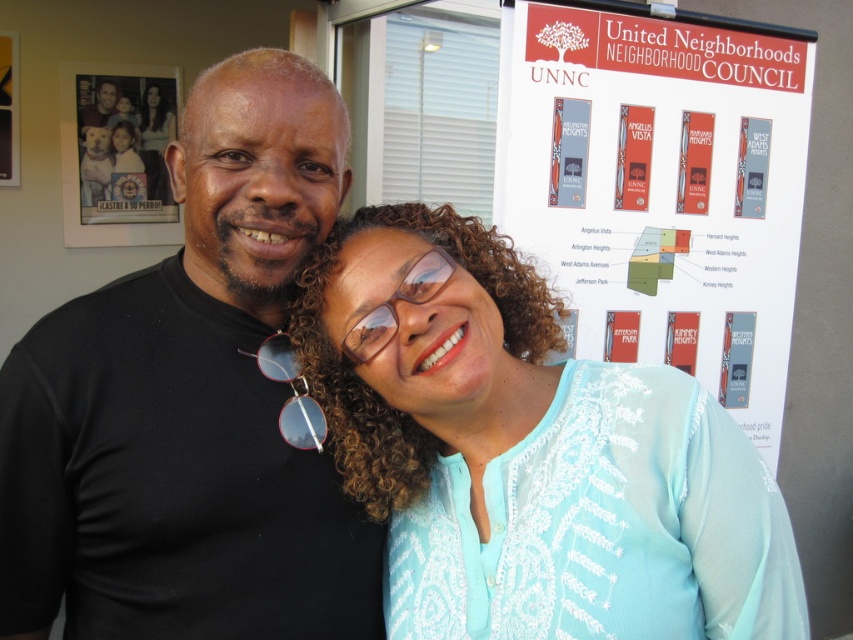
Question: Which object is closer to the camera taking this photo?

Choices:
 (A) black matte t-shirt at left
 (B) matte red sign at upper right
 (C) matte black photo at upper left
 (D) matte red banner at upper center

Answer: (A)

Question: Which object appears farthest from the camera in this image?

Choices:
 (A) transparent plastic glasses at center
 (B) matte red sign at upper center
 (C) matte red banner at upper center
 (D) black matte t-shirt at left

Answer: (C)

Question: Can you confirm if red paper poster at upper right is positioned above matte red sign at upper center?

Choices:
 (A) no
 (B) yes

Answer: (A)

Question: Is matte black photo at upper left closer to the viewer compared to transparent plastic glasses at center?

Choices:
 (A) yes
 (B) no

Answer: (B)

Question: Does red paper poster at upper right have a lesser width compared to matte red sign at upper center?

Choices:
 (A) no
 (B) yes

Answer: (A)

Question: Considering the real-world distances, which object is farthest from the matte red sign at upper right?

Choices:
 (A) matte black photo at upper left
 (B) light blue embroidered blouse at center
 (C) translucent plastic sunglasses at center
 (D) black matte t-shirt at left

Answer: (A)